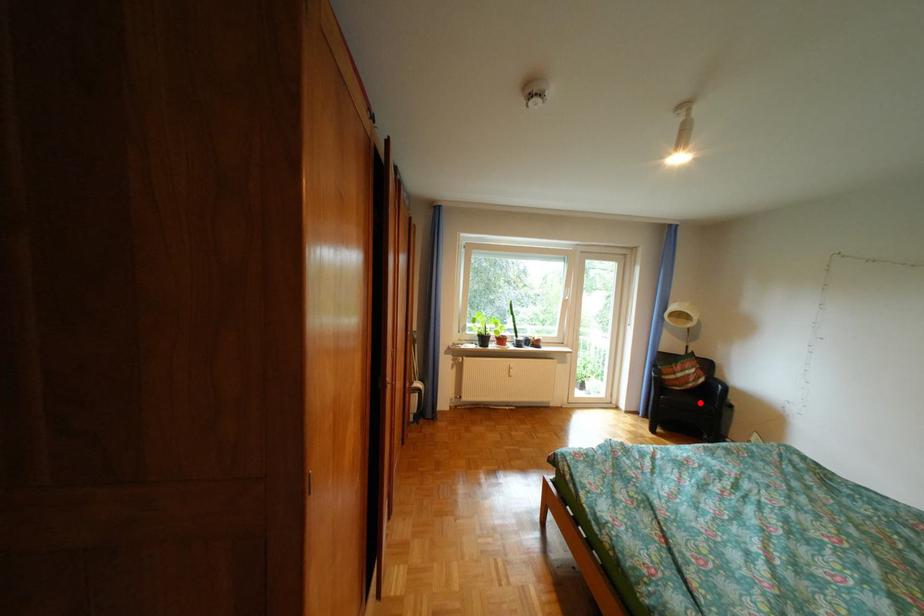
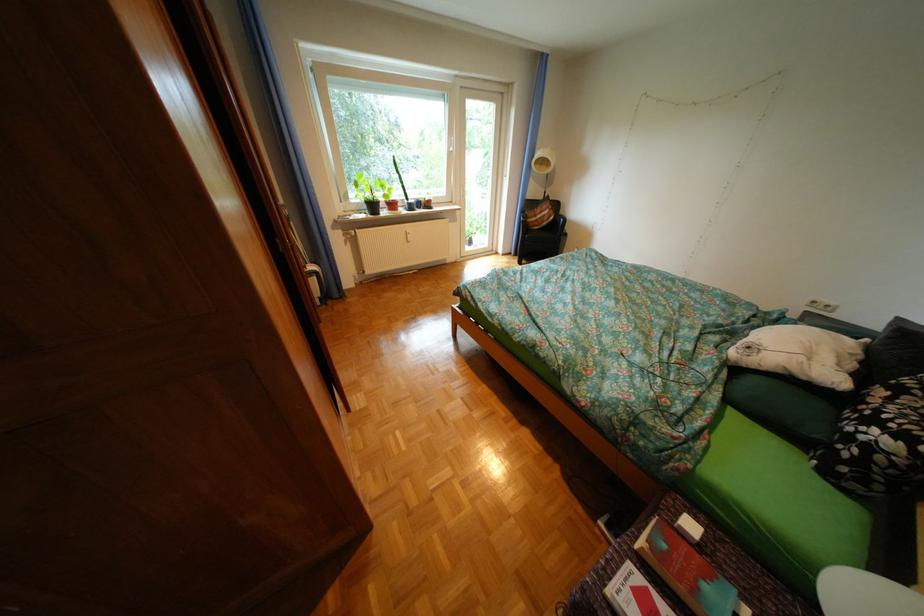
Question: I am providing you with two images of the same scene from different viewpoints. A red point is marked on the first image. Is the red point's position out of view in image 2?

Choices:
 (A) Yes
 (B) No

Answer: (B)